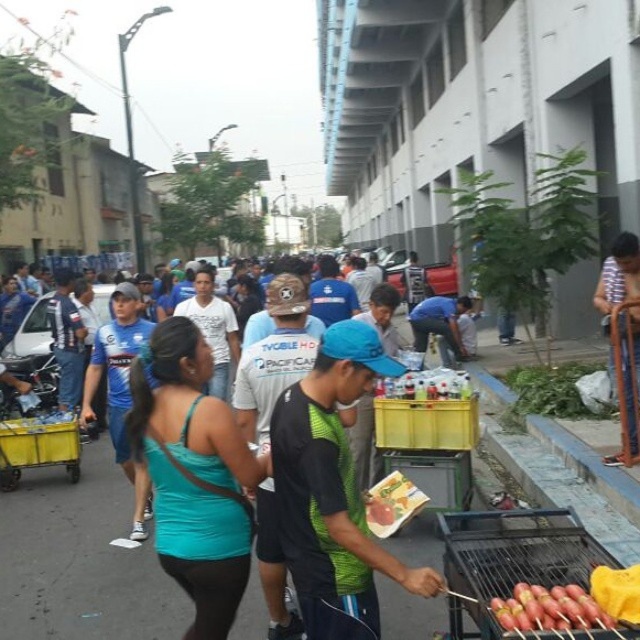
Question: Can you confirm if shiny golden hot dogs at lower right is smaller than smooth plastic baguette at center?

Choices:
 (A) yes
 (B) no

Answer: (A)

Question: Based on their relative distances, which object is farther from the metallic grill at lower right?

Choices:
 (A) shiny golden hot dogs at lower right
 (B) black fabric shirt at center

Answer: (B)

Question: Is metallic grill at lower right below smooth plastic baguette at center?

Choices:
 (A) no
 (B) yes

Answer: (A)

Question: Which object is closer to the camera taking this photo?

Choices:
 (A) smooth plastic baguette at center
 (B) shiny golden hot dogs at lower right
 (C) yellow plastic cart at lower left

Answer: (B)

Question: Can you confirm if metallic grill at lower right is wider than smooth plastic baguette at center?

Choices:
 (A) yes
 (B) no

Answer: (A)

Question: Which point is closer to the camera?

Choices:
 (A) (323, 516)
 (B) (508, 532)
 (C) (560, 602)

Answer: (C)